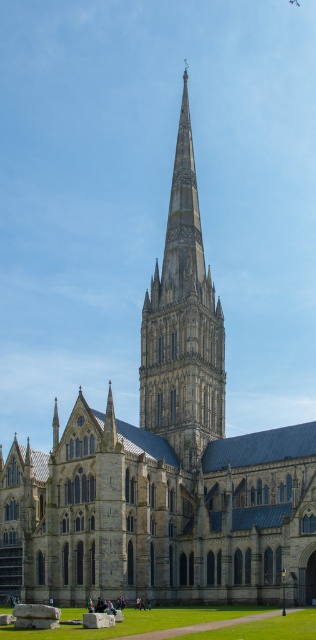
Question: Which point appears farthest from the camera in this image?

Choices:
 (A) (255, 630)
 (B) (212, 349)

Answer: (B)

Question: In this image, where is gray stone spire at center located relative to green grass at lower center?

Choices:
 (A) above
 (B) below

Answer: (A)

Question: Is gray stone spire at center thinner than green grass at lower center?

Choices:
 (A) yes
 (B) no

Answer: (A)

Question: Can you confirm if gray stone spire at center is positioned below green grass at lower center?

Choices:
 (A) yes
 (B) no

Answer: (B)

Question: Among these points, which one is farthest from the camera?

Choices:
 (A) (71, 637)
 (B) (187, 300)

Answer: (B)